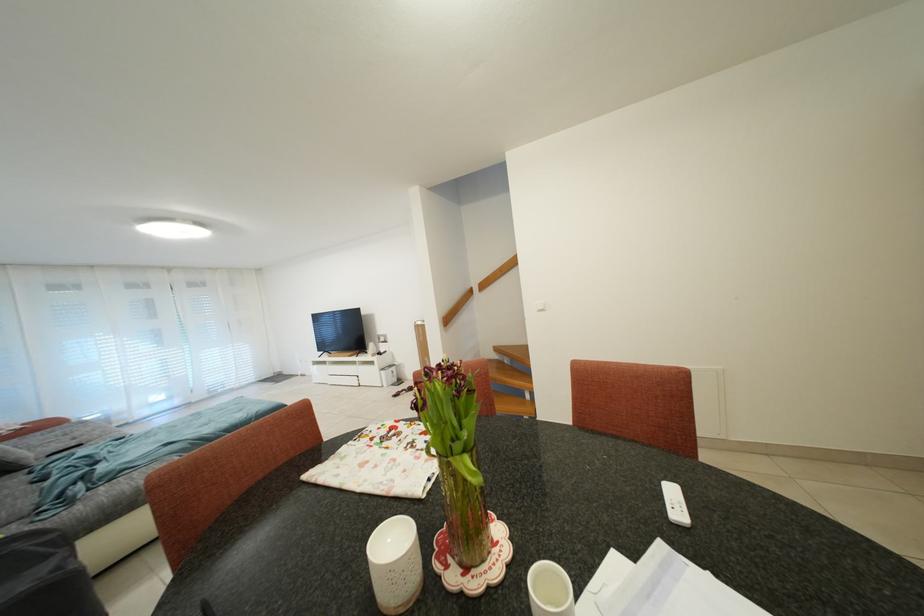
The width and height of the screenshot is (924, 616). In order to click on white remote control in this screenshot , I will do `click(675, 504)`.